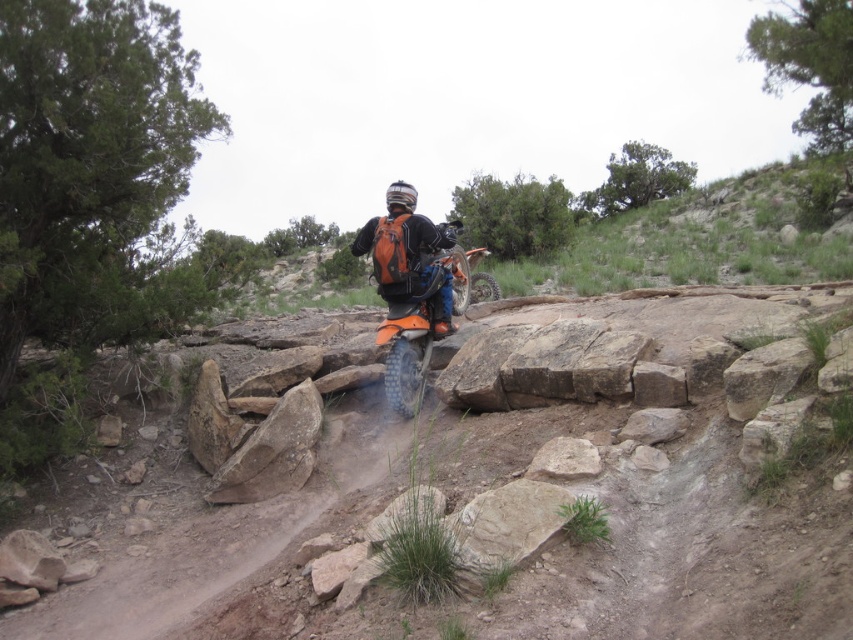
Question: Is dusty gravel dirt track at center further to the viewer compared to orange matte dirt bike at center?

Choices:
 (A) no
 (B) yes

Answer: (A)

Question: Is dusty gravel dirt track at center above orange matte dirt bike at center?

Choices:
 (A) yes
 (B) no

Answer: (B)

Question: Is dusty gravel dirt track at center bigger than orange matte dirt bike at center?

Choices:
 (A) yes
 (B) no

Answer: (A)

Question: Which is nearer to the dusty gravel dirt track at center?

Choices:
 (A) orange matte backpack at center
 (B) orange matte dirt bike at center

Answer: (B)

Question: Which object is positioned farthest from the dusty gravel dirt track at center?

Choices:
 (A) orange matte backpack at center
 (B) orange matte dirt bike at center

Answer: (A)

Question: Which of the following is the farthest from the observer?

Choices:
 (A) dusty gravel dirt track at center
 (B) orange matte backpack at center

Answer: (B)